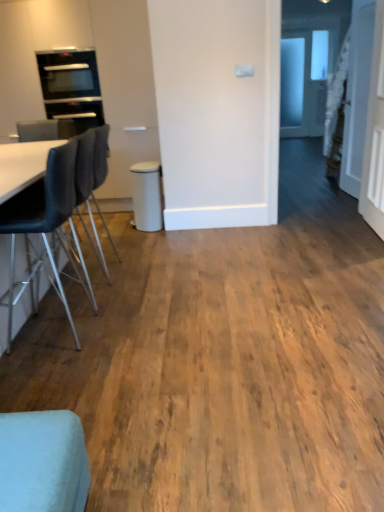
Locate an element on the screen. The height and width of the screenshot is (512, 384). spots to the right of black leather chair at left, the first chair from the back is located at coordinates (150, 300).